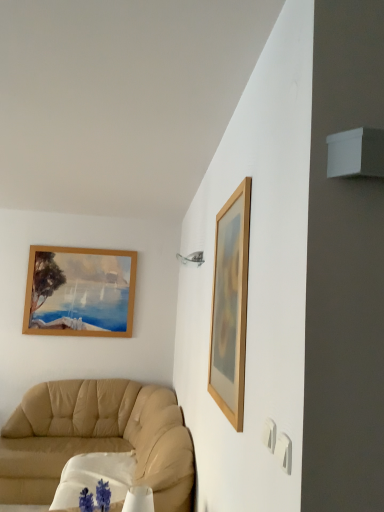
What do you see at coordinates (230, 305) in the screenshot? The image size is (384, 512). I see `wooden picture frame at upper right` at bounding box center [230, 305].

In order to face wooden picture frame at upper right, should I rotate leftwards or rightwards?

To align with it, rotate right about 4.487°.

Locate an element on the screen. Image resolution: width=384 pixels, height=512 pixels. white fabric round table at lower left is located at coordinates (94, 477).

In order to click on wooden picture frame at upper right in this screenshot , I will do `click(230, 305)`.

Identify the location of studio couch in front of the white fabric round table at lower left. The width and height of the screenshot is (384, 512). (96, 438).

Between white fabric round table at lower left and beige leather couch at lower left, which one has more height?

beige leather couch at lower left is taller.

From the image's perspective, is white fabric round table at lower left above or below beige leather couch at lower left?

Clearly, from the image's perspective, white fabric round table at lower left is below beige leather couch at lower left.

In terms of width, does white fabric round table at lower left look wider or thinner when compared to beige leather couch at lower left?

Clearly, white fabric round table at lower left has less width compared to beige leather couch at lower left.

How many degrees apart are the facing directions of wooden picture frame at upper right and beige leather couch at lower left?

There is a 1.04-degree angle between the facing directions of wooden picture frame at upper right and beige leather couch at lower left.

Would you say wooden picture frame at upper right is a long distance from beige leather couch at lower left?

wooden picture frame at upper right is far away from beige leather couch at lower left.

Based on the photo, from a real-world perspective, is wooden picture frame at upper right physically located above or below beige leather couch at lower left?

Result: Clearly, from a real-world perspective, wooden picture frame at upper right is above beige leather couch at lower left.

Is beige leather couch at lower left facing away from wooden picture frame at upper right?

No, beige leather couch at lower left's orientation is not away from wooden picture frame at upper right.

From the picture: Between beige leather couch at lower left and wooden picture frame at upper right, which one has larger width?

beige leather couch at lower left.

Identify the location of studio couch located on the left of wooden picture frame at upper right. coord(96,438).

Is wooden picture frame at upper right taller than white fabric round table at lower left?

Indeed, wooden picture frame at upper right has a greater height compared to white fabric round table at lower left.

The image size is (384, 512). Identify the location of round table to the left of wooden picture frame at upper right. 94,477.

Are wooden picture frame at upper right and white fabric round table at lower left making contact?

wooden picture frame at upper right is not next to white fabric round table at lower left, and they're not touching.

From the image's perspective, is wooden picture frame at upper right below white fabric round table at lower left?

No.

Does beige leather couch at lower left touch white fabric round table at lower left?

No, beige leather couch at lower left is not with white fabric round table at lower left.

From the image's perspective, relative to white fabric round table at lower left, is beige leather couch at lower left above or below?

Based on their image positions, beige leather couch at lower left is located above white fabric round table at lower left.

Is beige leather couch at lower left looking in the opposite direction of white fabric round table at lower left?

Correct, beige leather couch at lower left is looking away from white fabric round table at lower left.

Is point (73, 501) closer to camera compared to point (225, 403)?

That is False.

Which object is further away from the camera, white fabric round table at lower left or wooden picture frame at upper right?

white fabric round table at lower left is more distant.

Can you confirm if white fabric round table at lower left is positioned to the left of wooden picture frame at upper right?

Indeed, white fabric round table at lower left is positioned on the left side of wooden picture frame at upper right.

Locate an element on the screen. The image size is (384, 512). round table on the right side of beige leather couch at lower left is located at coordinates (94, 477).

Locate an element on the screen. The image size is (384, 512). picture frame above the beige leather couch at lower left (from a real-world perspective) is located at coordinates (230, 305).

When comparing their distances from beige leather couch at lower left, does white fabric round table at lower left or wooden picture frame at upper right seem closer?

The object closer to beige leather couch at lower left is white fabric round table at lower left.

Based on their spatial positions, is white fabric round table at lower left or beige leather couch at lower left further from wooden picture frame at upper right?

beige leather couch at lower left is positioned further to the anchor wooden picture frame at upper right.

Looking at this image, considering their positions, is wooden picture frame at upper right positioned further to beige leather couch at lower left than white fabric round table at lower left?

Based on the image, wooden picture frame at upper right appears to be further to beige leather couch at lower left.

Which object lies nearer to the anchor point wooden picture frame at upper right, beige leather couch at lower left or white fabric round table at lower left?

Among the two, white fabric round table at lower left is located nearer to wooden picture frame at upper right.

Which object lies further to the anchor point white fabric round table at lower left, beige leather couch at lower left or wooden picture frame at upper right?

The object further to white fabric round table at lower left is wooden picture frame at upper right.

Estimate the real-world distances between objects in this image. Which object is further from white fabric round table at lower left, wooden picture frame at upper right or beige leather couch at lower left?

wooden picture frame at upper right lies further to white fabric round table at lower left than the other object.

Identify the location of studio couch between wooden picture frame at upper right and white fabric round table at lower left in the up-down direction. The height and width of the screenshot is (512, 384). (96, 438).